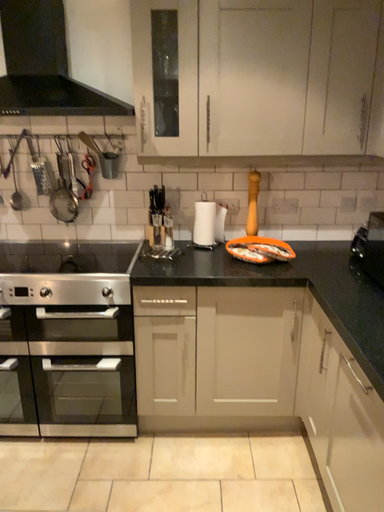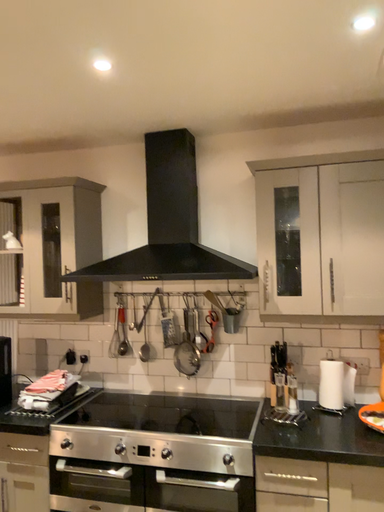
Question: Which way did the camera rotate in the video?

Choices:
 (A) rotated right
 (B) rotated left

Answer: (B)